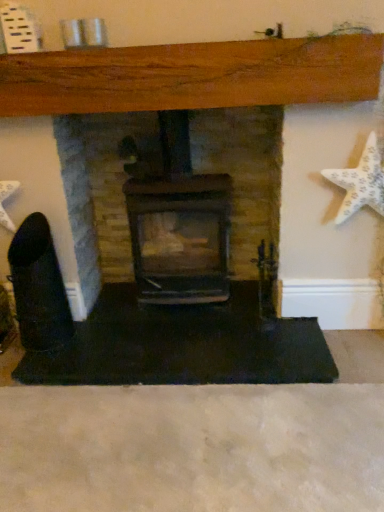
Question: Which direction should I rotate to look at matte black fireplace at center, which is the 1th fireplace from right to left, — up or down?

Choices:
 (A) down
 (B) up

Answer: (B)

Question: Can you confirm if black matte fireplace at center, the second fireplace viewed from the right, is smaller than matte black fireplace at center, which is the 1th fireplace from right to left?

Choices:
 (A) yes
 (B) no

Answer: (B)

Question: Considering the relative positions of black matte fireplace at center, marked as the 1th fireplace in a left-to-right arrangement, and matte black fireplace at center, which is the 1th fireplace from right to left, in the image provided, is black matte fireplace at center, marked as the 1th fireplace in a left-to-right arrangement, to the right of matte black fireplace at center, which is the 1th fireplace from right to left, from the viewer's perspective?

Choices:
 (A) yes
 (B) no

Answer: (B)

Question: Is black matte fireplace at center, the second fireplace viewed from the right, completely or partially outside of matte black fireplace at center, which is the second fireplace in left-to-right order?

Choices:
 (A) yes
 (B) no

Answer: (A)

Question: From the image's perspective, is black matte fireplace at center, marked as the 1th fireplace in a left-to-right arrangement, above matte black fireplace at center, which is the second fireplace in left-to-right order?

Choices:
 (A) yes
 (B) no

Answer: (B)

Question: Does black matte fireplace at center, marked as the 1th fireplace in a left-to-right arrangement, appear on the left side of matte black fireplace at center, which is the second fireplace in left-to-right order?

Choices:
 (A) no
 (B) yes

Answer: (B)

Question: Can you confirm if black matte fireplace at center, the second fireplace viewed from the right, is shorter than matte black fireplace at center, which is the 1th fireplace from right to left?

Choices:
 (A) yes
 (B) no

Answer: (A)

Question: Does black matte fireplace at center, the second fireplace viewed from the right, come in front of white textured starfish at right?

Choices:
 (A) no
 (B) yes

Answer: (A)

Question: Can you confirm if black matte fireplace at center, marked as the 1th fireplace in a left-to-right arrangement, is smaller than white textured starfish at right?

Choices:
 (A) no
 (B) yes

Answer: (A)

Question: Is white textured starfish at right completely or partially inside black matte fireplace at center, marked as the 1th fireplace in a left-to-right arrangement?

Choices:
 (A) yes
 (B) no

Answer: (B)

Question: From a real-world perspective, is black matte fireplace at center, the second fireplace viewed from the right, beneath white textured starfish at right?

Choices:
 (A) no
 (B) yes

Answer: (B)

Question: From the image's perspective, is black matte fireplace at center, marked as the 1th fireplace in a left-to-right arrangement, on top of white textured starfish at right?

Choices:
 (A) yes
 (B) no

Answer: (B)

Question: Is black matte fireplace at center, marked as the 1th fireplace in a left-to-right arrangement, outside of white textured starfish at right?

Choices:
 (A) no
 (B) yes

Answer: (B)

Question: Can you confirm if matte black fireplace at center, which is the 1th fireplace from right to left, is wider than black matte fireplace at center, the second fireplace viewed from the right?

Choices:
 (A) yes
 (B) no

Answer: (B)